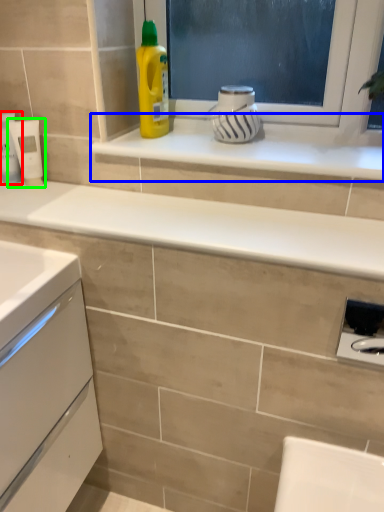
Question: Based on their relative distances, which object is nearer to toiletry (highlighted by a red box)? Choose from window sill (highlighted by a blue box) and appliance (highlighted by a green box).

Choices:
 (A) window sill
 (B) appliance

Answer: (B)